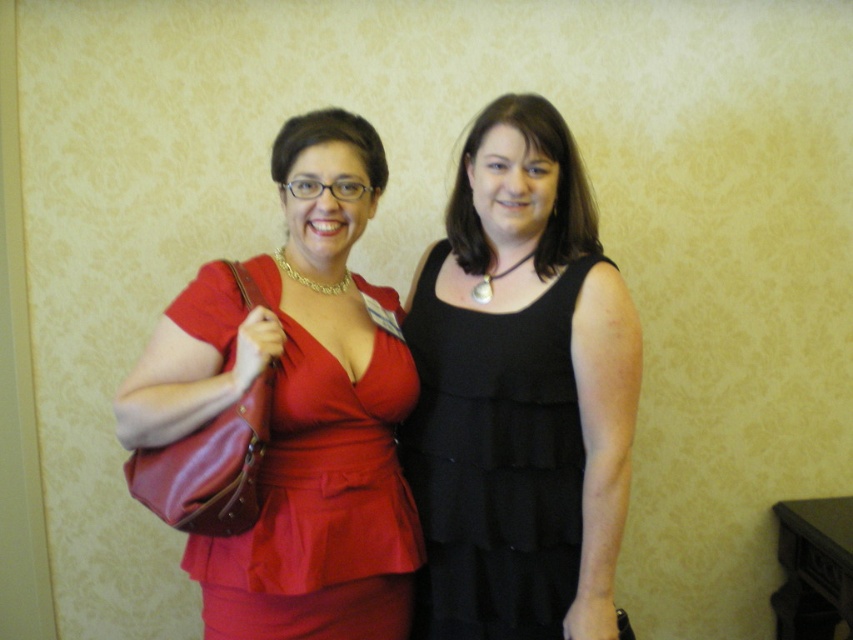
You are a fashion designer observing two dresses displayed in a store window. The black matte dress at center and the matte red dress at left are part of your new collection. You need to determine which dress requires more fabric to produce. Based on the image, which dress would you choose?

The matte red dress at left is larger than the black matte dress at center, so it would require more fabric to produce.

You are a photographer setting up a shoot in the scene described. You want to ensure that both the matte red dress at left and the black matte dress at center are fully visible in the photo. Given their current positions, which dress might partially block the other, and how should you adjust their positioning to avoid this?

The matte red dress at left is currently behind the black matte dress at center, so it might be partially blocked. To ensure both are fully visible, move the matte red dress at left to a position in front of or to the side of the black matte dress at center.